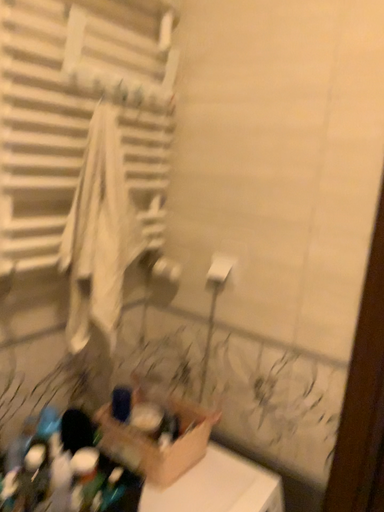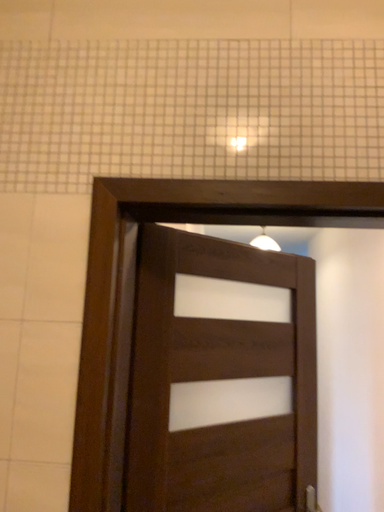
Question: How did the camera likely rotate when shooting the video?

Choices:
 (A) rotated upward
 (B) rotated downward

Answer: (A)